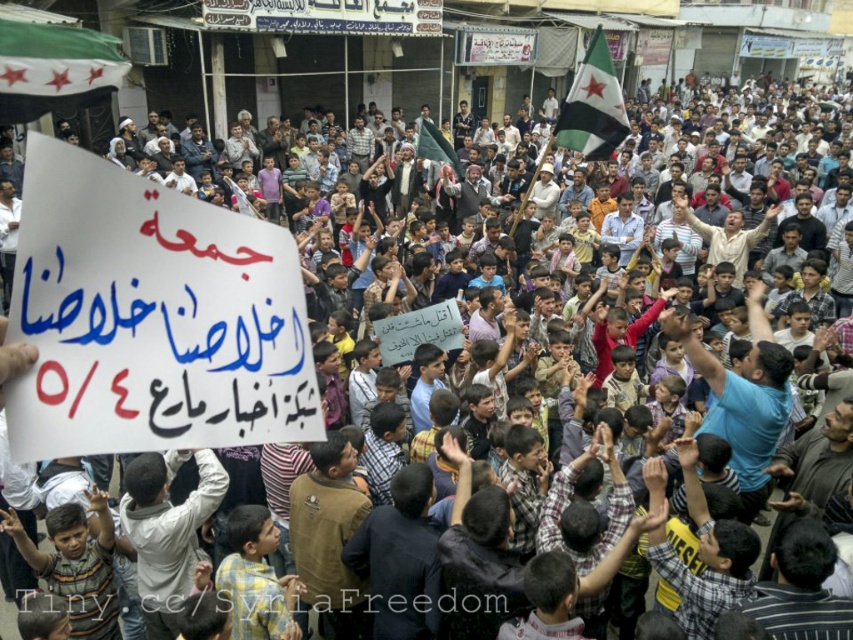
Between white fabric flag at upper left and green and white fabric flag at upper center, which one appears on the right side from the viewer's perspective?

From the viewer's perspective, green and white fabric flag at upper center appears more on the right side.

Between white fabric flag at upper left and green and white fabric flag at upper center, which one has more height?

Standing taller between the two is green and white fabric flag at upper center.

Is point (12, 74) farther from camera compared to point (608, 70)?

No.

Identify the location of white fabric flag at upper left. The image size is (853, 640). (54, 68).